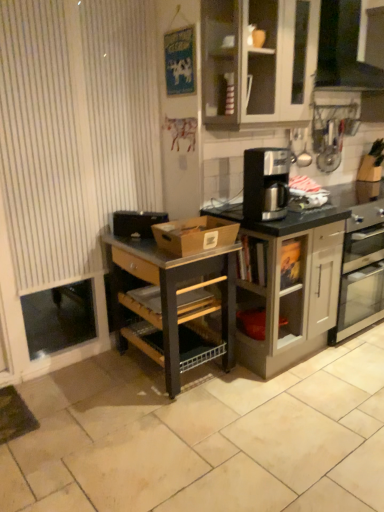
Where is `black glossy vent at upper right`? The height and width of the screenshot is (512, 384). black glossy vent at upper right is located at coordinates (343, 49).

This screenshot has width=384, height=512. What do you see at coordinates (343, 49) in the screenshot? I see `black glossy vent at upper right` at bounding box center [343, 49].

You are a GUI agent. You are given a task and a screenshot of the screen. Output one action in this format:
    pyautogui.click(x=<x>, y=<y>)
    Task: Click on the black matte toaster at left
    The width and height of the screenshot is (384, 512).
    Given the screenshot: What is the action you would take?
    pyautogui.click(x=137, y=223)

What do you see at coordinates (203, 437) in the screenshot? The height and width of the screenshot is (512, 384). I see `beige tile at lower center` at bounding box center [203, 437].

Describe the element at coordinates (74, 129) in the screenshot. I see `white striped curtain at left` at that location.

What do you see at coordinates (258, 61) in the screenshot? I see `matte glass cabinet at upper center, arranged as the 2th cabinetry when ordered from the bottom` at bounding box center [258, 61].

This screenshot has width=384, height=512. In order to click on matte glass cabinet at upper center, arranged as the 2th cabinetry when ordered from the bottom in this screenshot , I will do `click(258, 61)`.

Where is `brown cardboard box at center`? The width and height of the screenshot is (384, 512). brown cardboard box at center is located at coordinates (194, 234).

Are black plastic coffee maker at center and black granite coffee maker at center making contact?

No, black plastic coffee maker at center is not next to black granite coffee maker at center.

From a real-world perspective, which object stands above the other?

black plastic coffee maker at center is physically above.

Is black plastic coffee maker at center turned away from black granite coffee maker at center?

No, black plastic coffee maker at center is not facing away from black granite coffee maker at center.

What are the coordinates of `kitchen appliance in front of the black matte toaster at left` in the screenshot? It's located at (266, 183).

Is black matte toaster at left bigger or smaller than black plastic coffee maker at center?

Considering their sizes, black matte toaster at left takes up less space than black plastic coffee maker at center.

Is black matte toaster at left oriented away from black plastic coffee maker at center?

No, black plastic coffee maker at center is not at the back of black matte toaster at left.

Is black plastic coffee maker at center facing towards metallic black shelf at center?

No.

Which object is wider, black plastic coffee maker at center or metallic black shelf at center?

Wider between the two is metallic black shelf at center.

Is black plastic coffee maker at center at the right side of metallic black shelf at center?

Yes, black plastic coffee maker at center is to the right of metallic black shelf at center.

Is point (253, 197) less distant than point (205, 332)?

That is True.

Can you confirm if black matte toaster at left is bigger than metallic black shelf at center?

No, black matte toaster at left is not bigger than metallic black shelf at center.

Is black matte toaster at left closer to the viewer compared to metallic black shelf at center?

No, it is behind metallic black shelf at center.

Is point (148, 229) positioned after point (179, 380)?

That is True.

Considering the positions of points (124, 490) and (255, 183), is point (124, 490) farther from camera compared to point (255, 183)?

No.

Does beige tile at lower center have a greater width compared to black plastic coffee maker at center?

Yes, beige tile at lower center is wider than black plastic coffee maker at center.

I want to click on tile below the black plastic coffee maker at center (from the image's perspective), so click(203, 437).

Is beige tile at lower center bigger than black plastic coffee maker at center?

Indeed, beige tile at lower center has a larger size compared to black plastic coffee maker at center.

Considering the relative sizes of black glossy vent at upper right and black matte toaster at left in the image provided, is black glossy vent at upper right wider than black matte toaster at left?

Yes.

Measure the distance between black glossy vent at upper right and black matte toaster at left.

black glossy vent at upper right is 1.58 meters away from black matte toaster at left.

Considering the relative sizes of black glossy vent at upper right and black matte toaster at left in the image provided, is black glossy vent at upper right shorter than black matte toaster at left?

Incorrect, the height of black glossy vent at upper right does not fall short of that of black matte toaster at left.

Between black glossy vent at upper right and black matte toaster at left, which one appears on the right side from the viewer's perspective?

Positioned to the right is black glossy vent at upper right.

Is black glossy vent at upper right at the back of white striped curtain at left?

white striped curtain at left is not turned away from black glossy vent at upper right.

From the picture: Is white striped curtain at left located outside black glossy vent at upper right?

Yes.

Looking at this image, would you say white striped curtain at left is a long distance from black glossy vent at upper right?

Result: white striped curtain at left is far away from black glossy vent at upper right.

From the image's perspective, is white striped curtain at left over black glossy vent at upper right?

No.

What are the coordinates of `kitchen appliance located above the black granite coffee maker at center (from the image's perspective)` in the screenshot? It's located at (266, 183).

This screenshot has height=512, width=384. Find the location of `kitchen appliance in front of the black matte toaster at left`. kitchen appliance in front of the black matte toaster at left is located at coordinates (266, 183).

Which object lies nearer to the anchor point metallic black shelf at center, brown cardboard box at center or black matte toaster at left?

brown cardboard box at center lies closer to metallic black shelf at center than the other object.

When comparing their distances from black granite coffee maker at center, does matte gray cabinet at center, which is the 2th cabinetry in top-to-bottom order, or black matte toaster at left seem further?

black matte toaster at left lies further to black granite coffee maker at center than the other object.

Estimate the real-world distances between objects in this image. Which object is further from matte glass cabinet at upper center, the first cabinetry in the top-to-bottom sequence, black matte toaster at left or matte gray cabinet at center, the 1th cabinetry positioned from the bottom?

black matte toaster at left is further to matte glass cabinet at upper center, the first cabinetry in the top-to-bottom sequence.

Which object lies nearer to the anchor point beige tile at lower center, black plastic coffee maker at center or brown cardboard box at center?

brown cardboard box at center is positioned closer to the anchor beige tile at lower center.

Based on their spatial positions, is matte glass cabinet at upper center, the first cabinetry in the top-to-bottom sequence, or metallic black shelf at center closer to black matte toaster at left?

metallic black shelf at center.

Based on their spatial positions, is black plastic coffee maker at center or black glossy vent at upper right further from beige tile at lower center?

black glossy vent at upper right is positioned further to the anchor beige tile at lower center.

Estimate the real-world distances between objects in this image. Which object is further from black granite coffee maker at center, matte glass cabinet at upper center, arranged as the 2th cabinetry when ordered from the bottom, or brown cardboard box at center?

matte glass cabinet at upper center, arranged as the 2th cabinetry when ordered from the bottom, is further to black granite coffee maker at center.

From the image, which object appears to be farther from black granite coffee maker at center, brown cardboard box at center or matte gray cabinet at center, the 1th cabinetry positioned from the bottom?

Based on the image, matte gray cabinet at center, the 1th cabinetry positioned from the bottom, appears to be further to black granite coffee maker at center.

This screenshot has height=512, width=384. Identify the location of shelf between black matte toaster at left and matte gray cabinet at center, the 1th cabinetry positioned from the bottom, from left to right. (175, 301).

Locate an element on the screen. Image resolution: width=384 pixels, height=512 pixels. kitchen appliance between metallic black shelf at center and black granite coffee maker at center is located at coordinates (266, 183).

This screenshot has width=384, height=512. Identify the location of cardboard box between black matte toaster at left and metallic black shelf at center vertically. (194, 234).

Find the location of `kitchen appliance between white striped curtain at left and matte gray cabinet at center, the 1th cabinetry positioned from the bottom`. kitchen appliance between white striped curtain at left and matte gray cabinet at center, the 1th cabinetry positioned from the bottom is located at coordinates (266, 183).